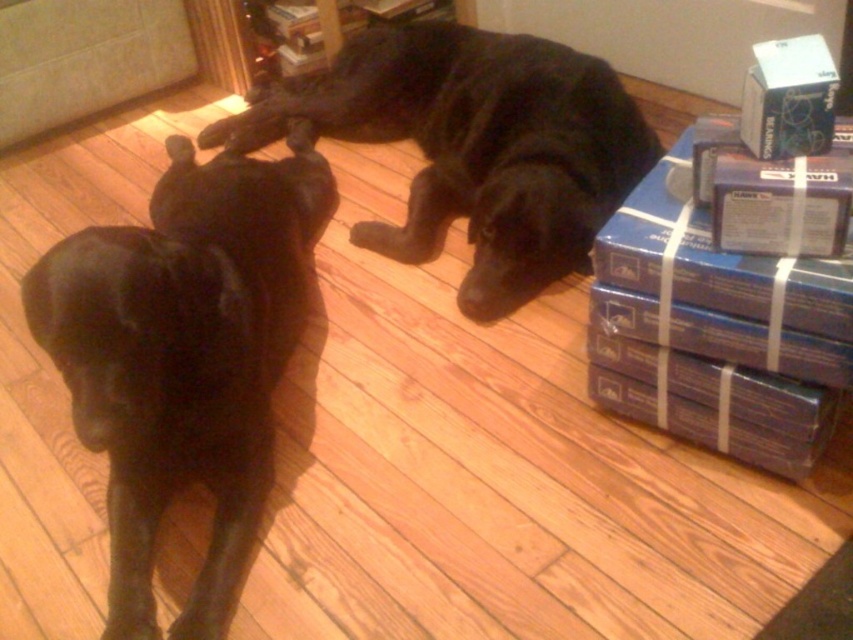
From the picture: Is shiny black dog at left shorter than black matte dog at center?

No, shiny black dog at left is not shorter than black matte dog at center.

At what (x,y) coordinates should I click in order to perform the action: click on shiny black dog at left. Please return your answer as a coordinate pair (x, y). The height and width of the screenshot is (640, 853). Looking at the image, I should click on (184, 356).

What do you see at coordinates (184, 356) in the screenshot? I see `shiny black dog at left` at bounding box center [184, 356].

Where is `shiny black dog at left`? shiny black dog at left is located at coordinates (184, 356).